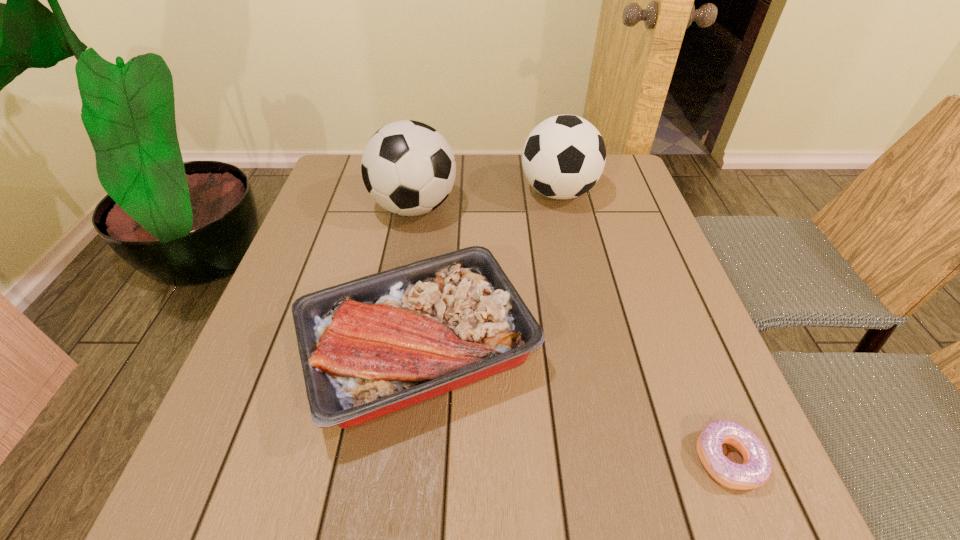
At what (x,y) coordinates should I click in order to perform the action: click on soccer ball present at the left edge. Please return your answer as a coordinate pair (x, y). The height and width of the screenshot is (540, 960). Looking at the image, I should click on (408, 168).

Locate an element on the screen. tray that is at the left edge is located at coordinates (369, 347).

At what (x,y) coordinates should I click in order to perform the action: click on soccer ball situated at the right edge. Please return your answer as a coordinate pair (x, y). Looking at the image, I should click on pyautogui.click(x=564, y=156).

Identify the location of doughnut present at the right edge. (756, 470).

This screenshot has width=960, height=540. Identify the location of object located at the far left corner. (408, 168).

Locate an element on the screen. The height and width of the screenshot is (540, 960). object present at the far right corner is located at coordinates (564, 156).

Locate an element on the screen. object at the near right corner is located at coordinates [x=756, y=470].

You are a GUI agent. You are given a task and a screenshot of the screen. Output one action in this format:
    pyautogui.click(x=<x>, y=<y>)
    Task: Click on the free space at the far edge of the desktop
    This screenshot has width=960, height=540.
    Given the screenshot: What is the action you would take?
    pyautogui.click(x=521, y=194)

Where is `vacant area at the near edge`? The image size is (960, 540). vacant area at the near edge is located at coordinates (625, 494).

This screenshot has width=960, height=540. Identify the location of free region at the left edge of the desktop. (317, 232).